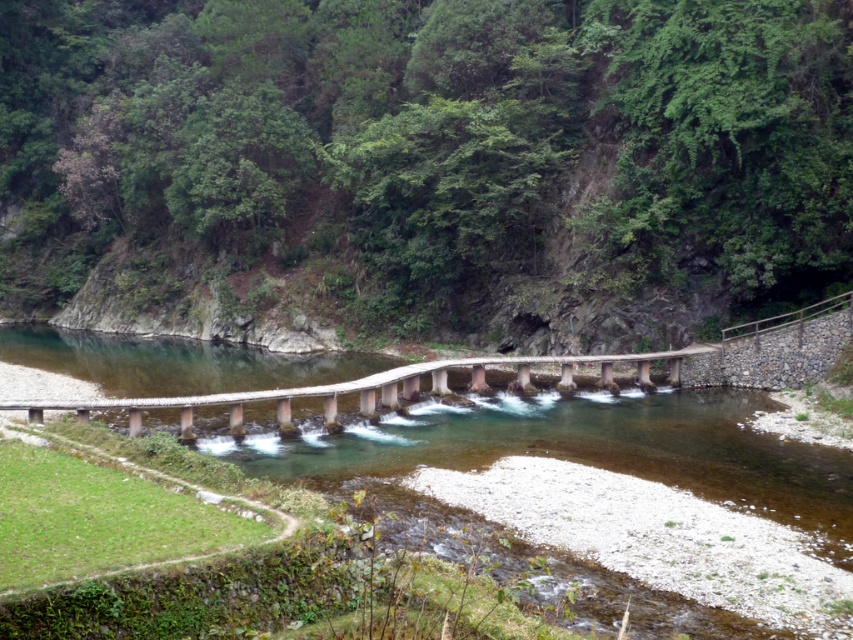
Question: Does green leafy hillside at upper center appear on the left side of wooden bridge at center?

Choices:
 (A) no
 (B) yes

Answer: (B)

Question: Is green leafy hillside at upper center closer to camera compared to wooden bridge at center?

Choices:
 (A) no
 (B) yes

Answer: (A)

Question: Does green leafy hillside at upper center appear under wooden bridge at center?

Choices:
 (A) no
 (B) yes

Answer: (A)

Question: Which object is closer to the camera taking this photo?

Choices:
 (A) wooden bridge at center
 (B) green leafy hillside at upper center

Answer: (A)

Question: Which point is farther to the camera?

Choices:
 (A) (314, 364)
 (B) (375, 252)

Answer: (B)

Question: Which point appears closest to the camera in this image?

Choices:
 (A) (57, 225)
 (B) (73, 368)

Answer: (B)